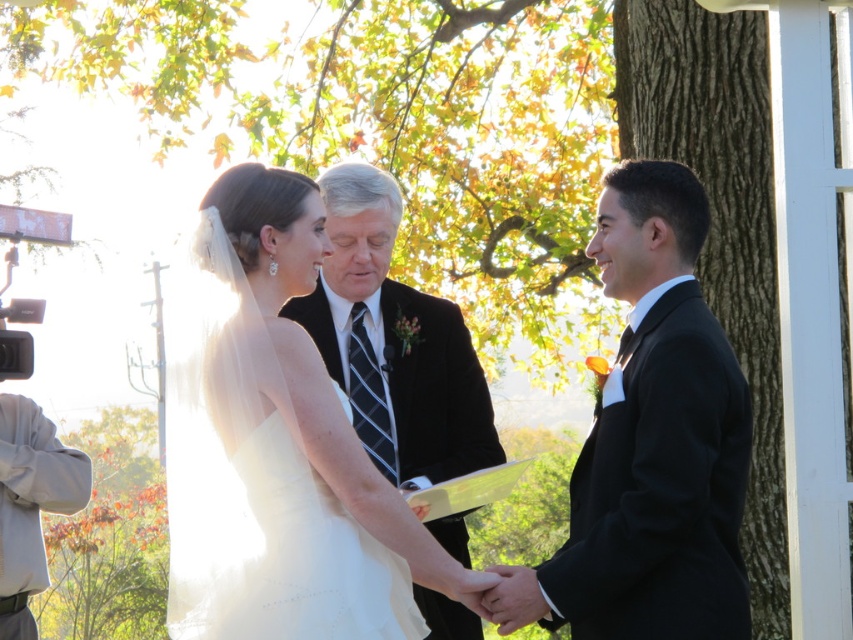
You are a photographer at the wedding ceremony. You need to adjust your camera to focus on the white satin dress at center. What are the coordinates where you should aim the camera?

The white satin dress at center is located at coordinates point (277, 448), so you should aim the camera at those coordinates to focus on it.

Looking at this image, you are a photographer at a wedding ceremony. You need to capture a photo of the white satin dress at center and the black satin suit at right. The minimum distance required for your camera to focus properly is 35 inches. Based on the scene, will the camera be able to focus on both subjects clearly?

The white satin dress at center is 34.73 inches from the black satin suit at right. Since the distance is less than the 35 inches minimum requirement, the camera may not be able to focus on both subjects clearly.

Based on the scene description, which object is shorter in height between the white satin dress at center and the black satin suit at right?

The white satin dress at center is shorter in height compared to the black satin suit at right.